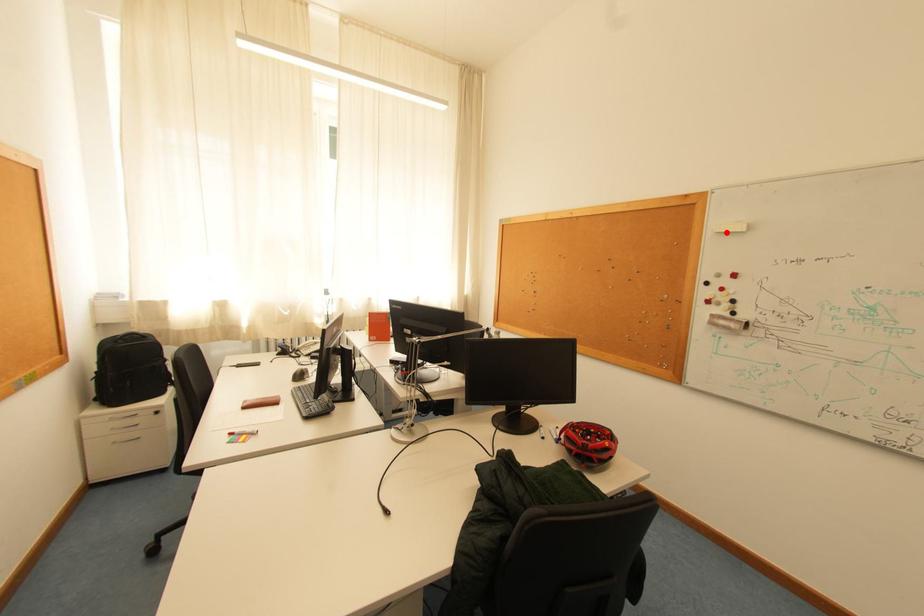
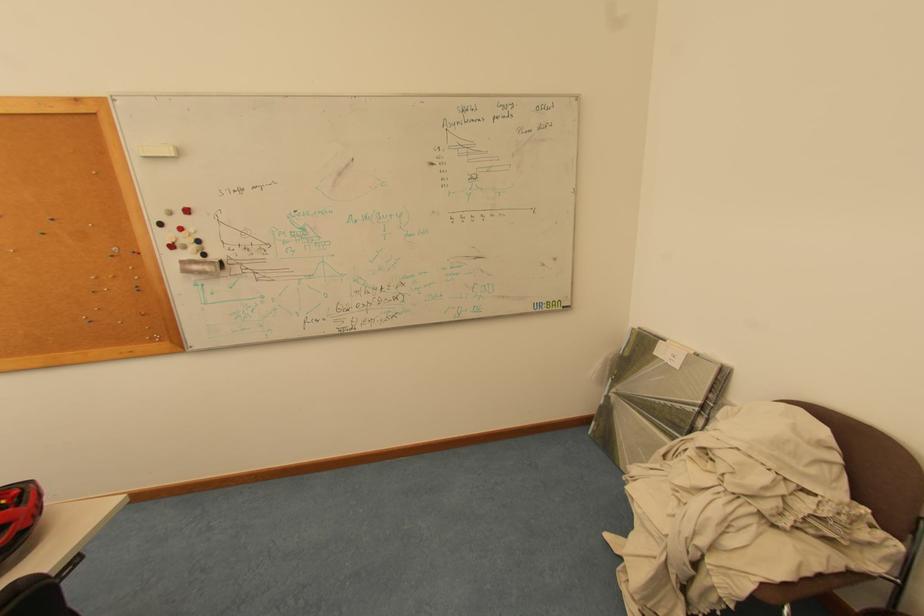
Find the pixel in the second image that matches the highlighted location in the first image.

(152, 156)